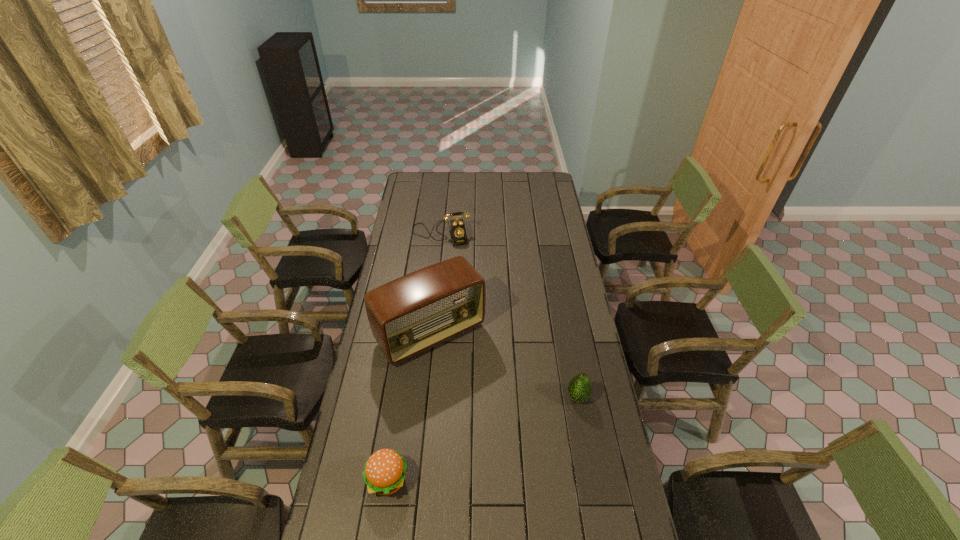
At what (x,y) coordinates should I click in order to perform the action: click on vacant space located 0.280m on the front-facing side of the third nearest object. Please return your answer as a coordinate pair (x, y). Looking at the image, I should click on (498, 421).

Where is `free space located on the dial of the farthest object`? free space located on the dial of the farthest object is located at coordinates (452, 281).

The height and width of the screenshot is (540, 960). I want to click on free space located on the dial of the farthest object, so [x=452, y=281].

In order to click on vacant space positioned on the dial of the farthest object in this screenshot , I will do `click(454, 289)`.

Identify the location of hamburger present at the left edge. The width and height of the screenshot is (960, 540). (384, 473).

I want to click on radio receiver situated at the left edge, so click(409, 315).

Where is `telephone present at the left edge`? telephone present at the left edge is located at coordinates (458, 232).

You are a GUI agent. You are given a task and a screenshot of the screen. Output one action in this format:
    pyautogui.click(x=<x>, y=<y>)
    Task: Click on the object located in the right edge section of the desktop
    The width and height of the screenshot is (960, 540).
    Given the screenshot: What is the action you would take?
    pyautogui.click(x=579, y=388)

Image resolution: width=960 pixels, height=540 pixels. In the image, there is a desktop. What are the coordinates of `vacant space at the far edge` in the screenshot? It's located at (511, 187).

Locate an element on the screen. vacant space at the left edge of the desktop is located at coordinates (372, 364).